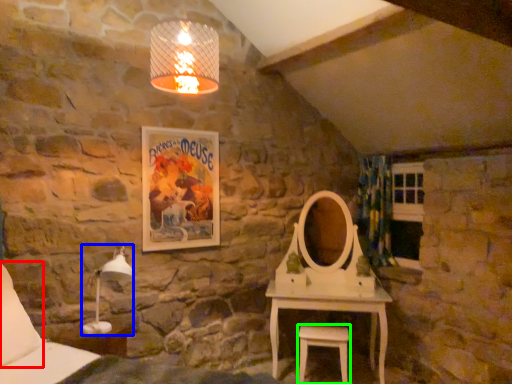
Question: Estimate the real-world distances between objects in this image. Which object is closer to pillow (highlighted by a red box), table lamp (highlighted by a blue box) or stool (highlighted by a green box)?

Choices:
 (A) table lamp
 (B) stool

Answer: (A)